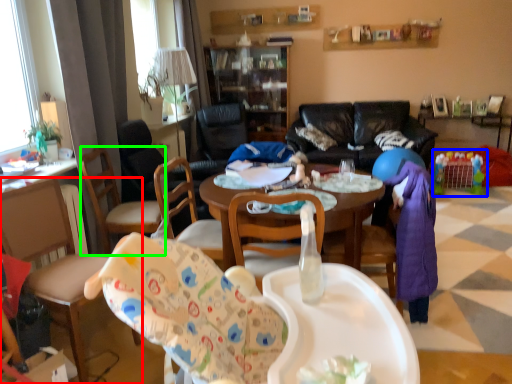
Question: Based on their relative distances, which object is farther from chair (highlighted by a red box)? Choose from toy (highlighted by a blue box) and armchair (highlighted by a green box).

Choices:
 (A) toy
 (B) armchair

Answer: (A)